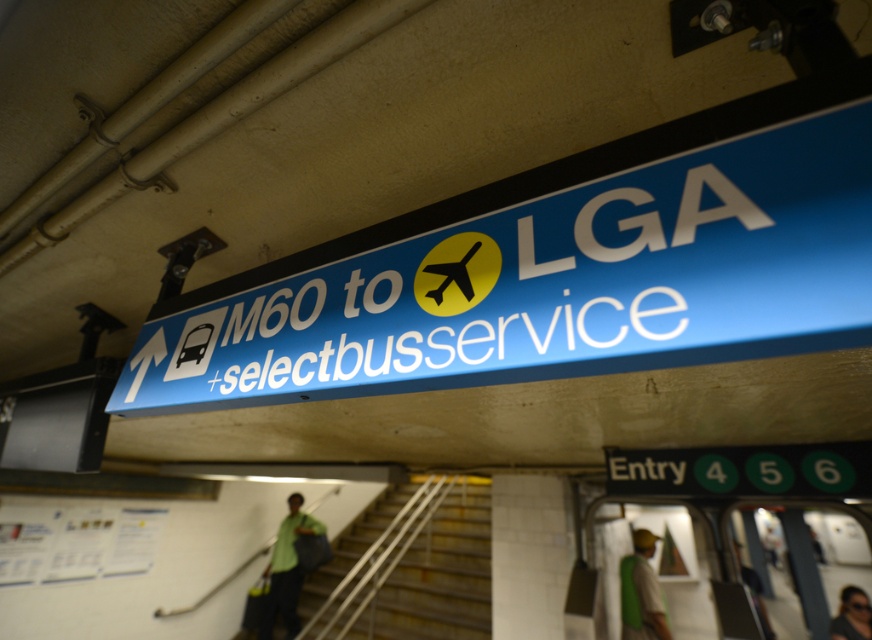
Question: Among these objects, which one is farthest from the camera?

Choices:
 (A) dark hair at upper right
 (B) green fabric bag at lower right

Answer: (A)

Question: Which point is farther to the camera?

Choices:
 (A) dark hair at upper right
 (B) green fabric shirt at lower right
 (C) green fabric bag at lower right

Answer: (B)

Question: From the image, what is the correct spatial relationship of metallic gray stairs at center in relation to dark hair at upper right?

Choices:
 (A) below
 (B) above

Answer: (B)

Question: Does blue glossy sign at upper center appear on the right side of green fabric shirt at lower right?

Choices:
 (A) no
 (B) yes

Answer: (A)

Question: Is green matte shirt at lower center positioned before green fabric bag at lower right?

Choices:
 (A) yes
 (B) no

Answer: (B)

Question: Estimate the real-world distances between objects in this image. Which object is closer to the green fabric bag at lower right?

Choices:
 (A) green fabric shirt at lower right
 (B) dark hair at upper right

Answer: (B)